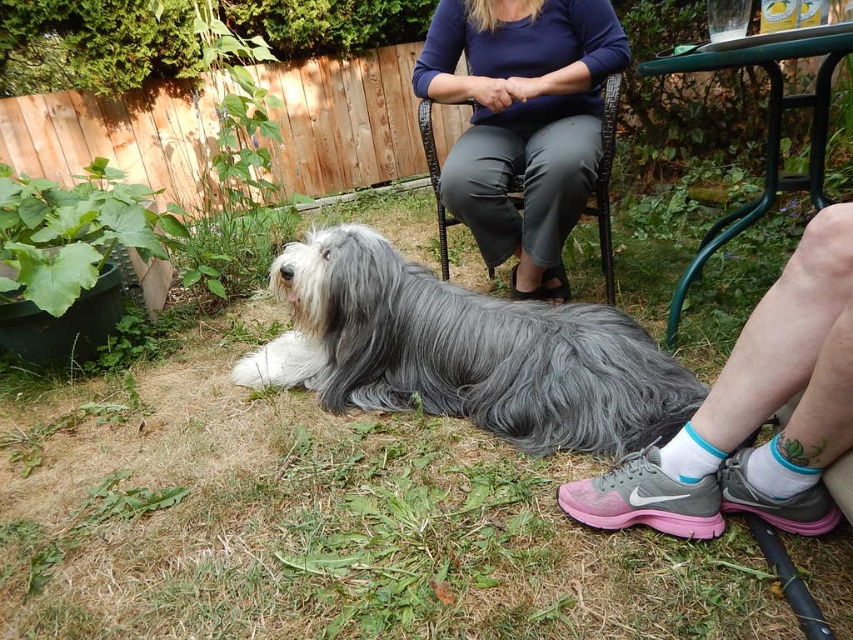
You are standing at the center of the backyard and see the gray fluffy dog at center. If you want to walk directly towards the dog, which direction should you move?

Since the gray fluffy dog at center is located at point (463, 352), you should move slightly to the right and forward to reach the dog.

You are a photographer setting up a tripod to take a portrait of the gray fluffy dog at center and the woven wicker chair at center. Which object should you focus on first if you want to ensure both are in sharp focus, considering their sizes?

The gray fluffy dog at center has a lesser height compared to the woven wicker chair at center, so you should focus on the woven wicker chair at center first since it is taller and will require more precise focusing to ensure both are in sharp focus.

You are standing at the center of the backyard and want to find the gray fluffy dog at center. According to the image, where should you look relative to your position?

The gray fluffy dog at center is located at point (463, 352), which is slightly to the right and just below the center of the image. Since you are at the center, you should look slightly to your right and down a bit to find it.